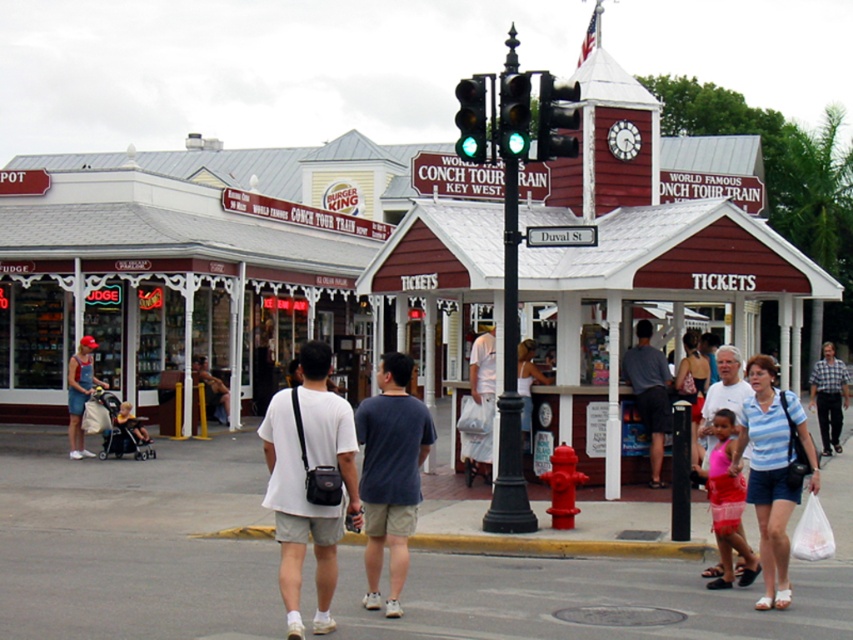
Can you confirm if white painted building at left is taller than plaid shirt at center?

Yes, white painted building at left is taller than plaid shirt at center.

Identify the location of white painted building at left. tap(164, 284).

Where is `white painted building at left`? This screenshot has width=853, height=640. white painted building at left is located at coordinates (164, 284).

Can you confirm if white painted building at left is shorter than matte black guitar at left?

In fact, white painted building at left may be taller than matte black guitar at left.

Between point (90, 177) and point (134, 433), which one is positioned in front?

Point (134, 433) is more forward.

The image size is (853, 640). I want to click on white painted building at left, so click(164, 284).

Between dark gray shirt at center and matte black guitar at left, which one is positioned lower?

Positioned lower is matte black guitar at left.

In the scene shown: Is dark gray shirt at center wider than matte black guitar at left?

Yes.

Image resolution: width=853 pixels, height=640 pixels. What do you see at coordinates (648, 394) in the screenshot?
I see `dark gray shirt at center` at bounding box center [648, 394].

The image size is (853, 640). I want to click on dark gray shirt at center, so click(x=648, y=394).